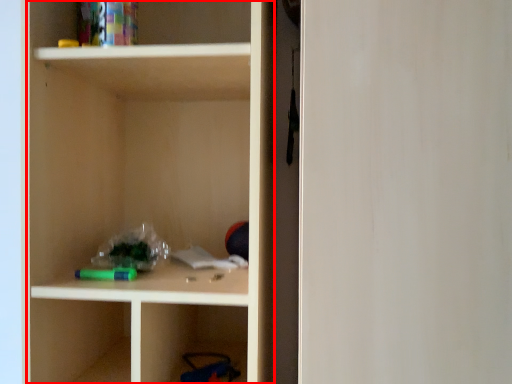
Question: From the image's perspective, where is cabinetry (annotated by the red box) located relative to glass door?

Choices:
 (A) below
 (B) above

Answer: (B)